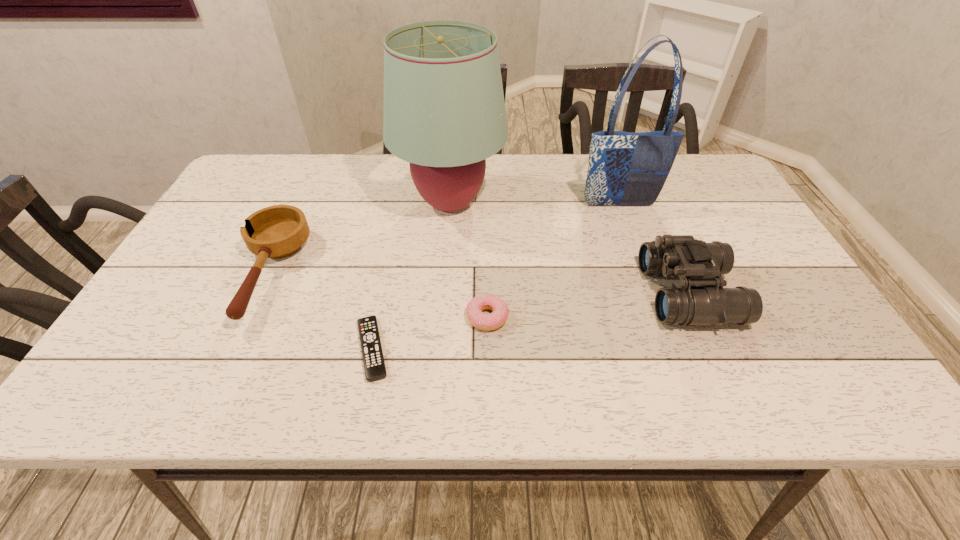
In the image, there is a desktop. What are the coordinates of `vacant space at the right edge` in the screenshot? It's located at (741, 218).

Where is `free region at the near left corner`? The image size is (960, 540). free region at the near left corner is located at coordinates (106, 402).

In the image, there is a desktop. Identify the location of vacant space at the near right corner. (825, 402).

Locate an element on the screen. free space between the doughnut and the saucepan is located at coordinates (378, 295).

This screenshot has height=540, width=960. Identify the location of vacant area that lies between the shopping bag and the leftmost object. (444, 239).

Locate an element on the screen. blank region between the shopping bag and the lampshade is located at coordinates (535, 204).

Where is `vacant space in between the remote control and the lampshade`? Image resolution: width=960 pixels, height=540 pixels. vacant space in between the remote control and the lampshade is located at coordinates (411, 276).

Find the location of a particular element. The image size is (960, 540). vacant area that lies between the third shortest object and the doughnut is located at coordinates (378, 295).

This screenshot has height=540, width=960. I want to click on free space that is in between the fifth tallest object and the third tallest object, so click(x=588, y=305).

Where is `vacant area between the leftmost object and the second shortest object`? vacant area between the leftmost object and the second shortest object is located at coordinates (378, 295).